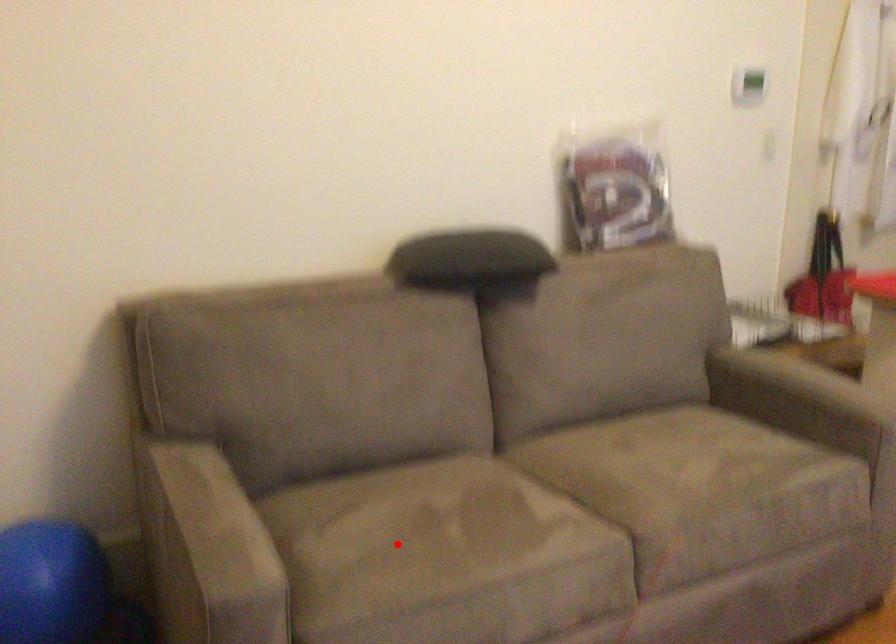
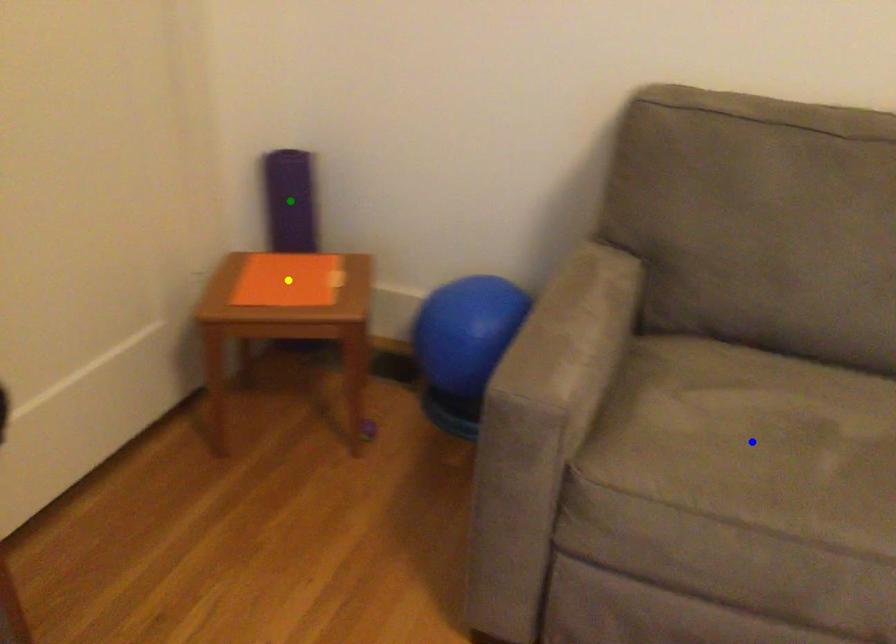
Question: I am providing you with two images of the same scene from different viewpoints. A red point is marked on the first image. You are given multiple points on the second image. Which spot in image 2 lines up with the point in image 1?

Choices:
 (A) blue point
 (B) green point
 (C) yellow point

Answer: (A)